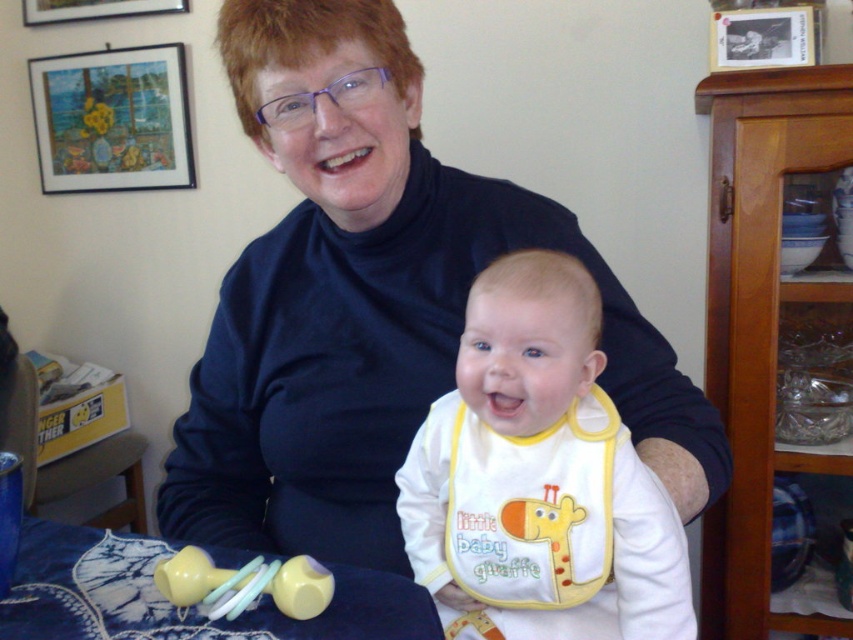
Based on the scene description, where is the framed canvas at upper left located in terms of its position relative to other objects in the image?

The framed canvas at upper left is located at the upper left corner of the image, positioned at coordinates approximately 0.188 along the x axis and 0.132 along the y axis.

You are standing in front of the table with the baby rattles. You want to pick up the object at point (141, 77). Is it within your reach?

The point (141, 77) is 2.31 meters away from the camera, so it is out of reach if you are standing in front of the table with the baby rattles.